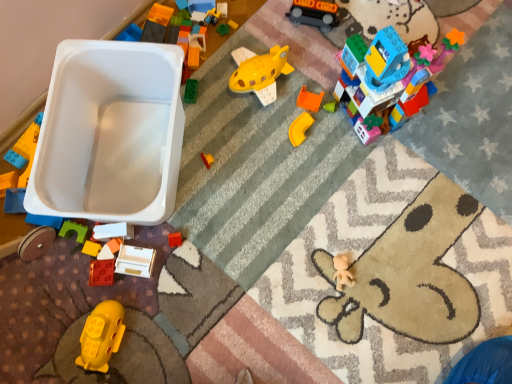
The image size is (512, 384). I want to click on free space in front of white matte block at lower left, arranged as the fifth toy when ordered from the bottom, so click(110, 300).